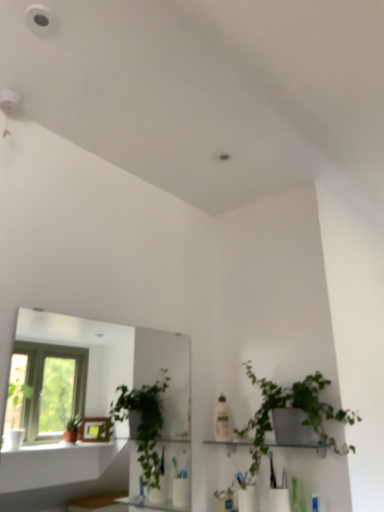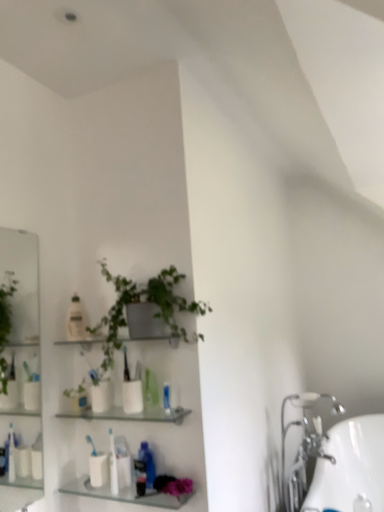
Question: How did the camera likely rotate when shooting the video?

Choices:
 (A) rotated right
 (B) rotated left

Answer: (A)